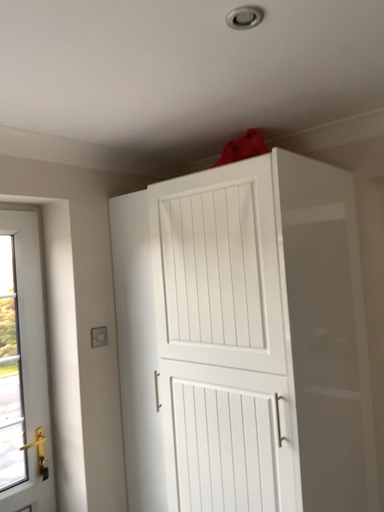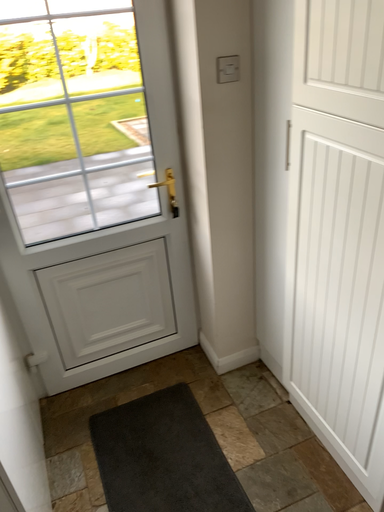
Question: Which way did the camera rotate in the video?

Choices:
 (A) rotated downward
 (B) rotated upward

Answer: (A)